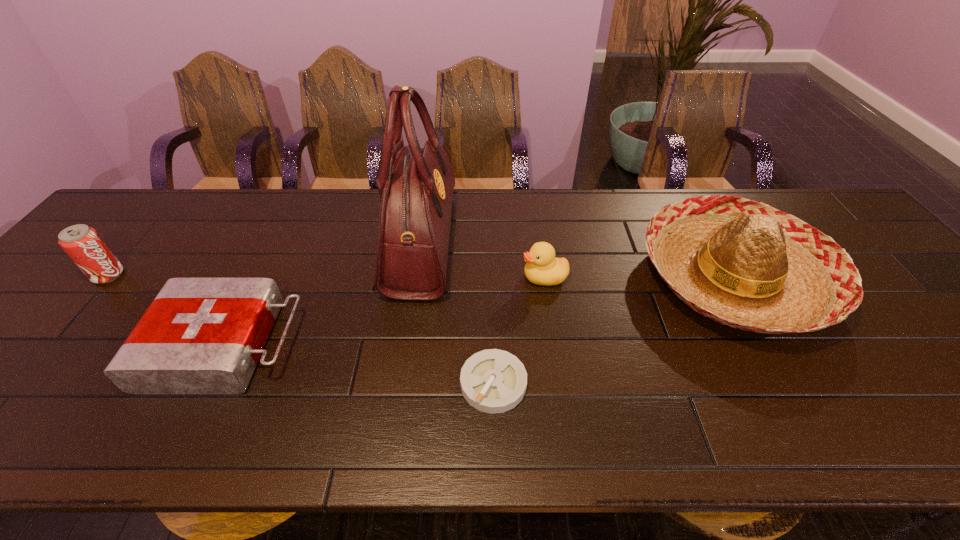
This screenshot has width=960, height=540. What are the coordinates of `vacant area in the image that satisfies the following two spatial constraints: 1. on the front-facing side of the third object from left to right; 2. on the right side of the fourth object from left to right` in the screenshot? It's located at (401, 383).

Find the location of a particular element. free space that satisfies the following two spatial constraints: 1. on the front-facing side of the handbag; 2. on the back side of the fifth shortest object is located at coordinates pos(417,278).